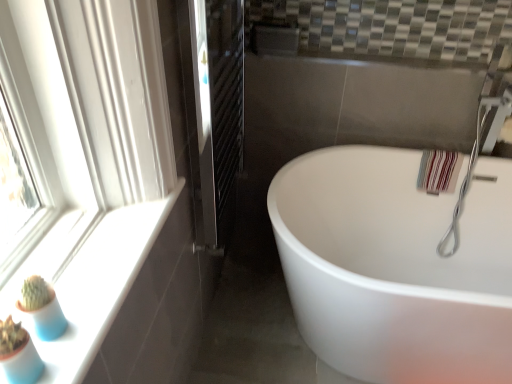
The height and width of the screenshot is (384, 512). In order to click on blank space situated above white glossy window sill at lower left (from a real-world perspective) in this screenshot , I will do 103,264.